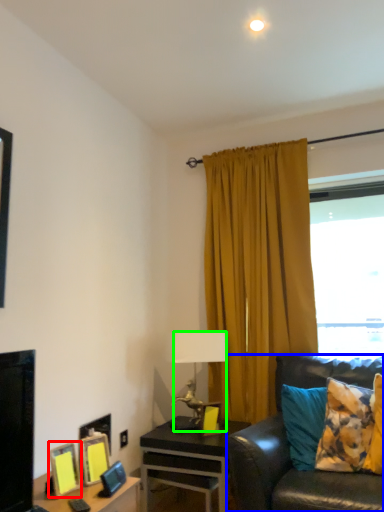
Question: Based on their relative distances, which object is farther from picture frame (highlighted by a red box)? Choose from studio couch (highlighted by a blue box) and lamp (highlighted by a green box).

Choices:
 (A) studio couch
 (B) lamp

Answer: (B)